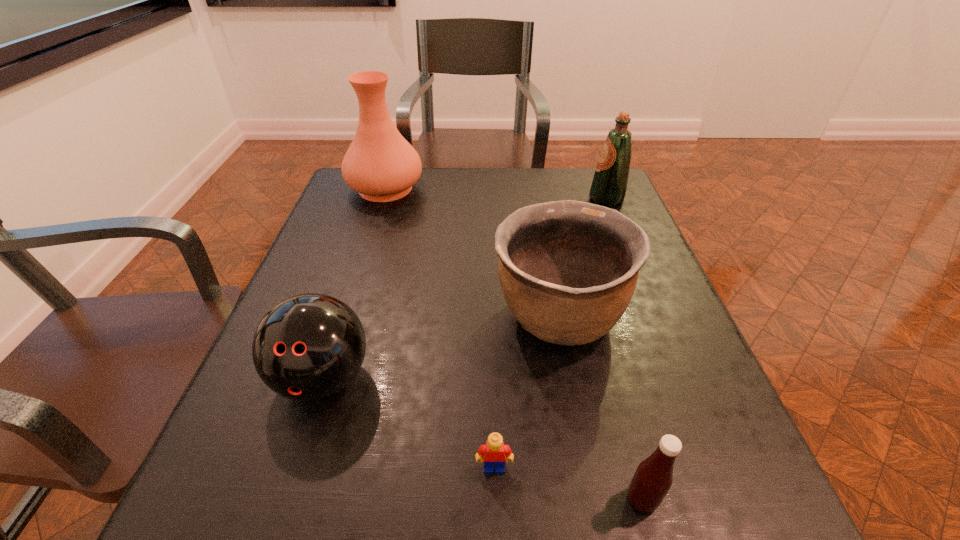
This screenshot has width=960, height=540. I want to click on vacant space at the right edge of the desktop, so click(x=714, y=397).

Find the location of a particular element. This screenshot has width=960, height=540. vacant position at the far left corner of the desktop is located at coordinates (339, 187).

In the image, there is a desktop. Identify the location of blank space at the far right corner. (565, 184).

This screenshot has width=960, height=540. I want to click on unoccupied position between the Tabasco sauce and the tallest object, so click(514, 344).

Where is `free space between the bowling ball and the pottery`? free space between the bowling ball and the pottery is located at coordinates (441, 348).

Find the location of `empty location between the shortest object and the bowling ball`. empty location between the shortest object and the bowling ball is located at coordinates (409, 423).

The image size is (960, 540). Identify the location of free space between the pottery and the tallest object. (472, 253).

The width and height of the screenshot is (960, 540). Find the location of `vacant point located between the rightmost object and the bowling ball`. vacant point located between the rightmost object and the bowling ball is located at coordinates [x=465, y=289].

Where is `free space between the vase and the pottery`? The width and height of the screenshot is (960, 540). free space between the vase and the pottery is located at coordinates tap(472, 253).

In order to click on free space between the olive oil and the bowling ball in this screenshot , I will do `click(465, 289)`.